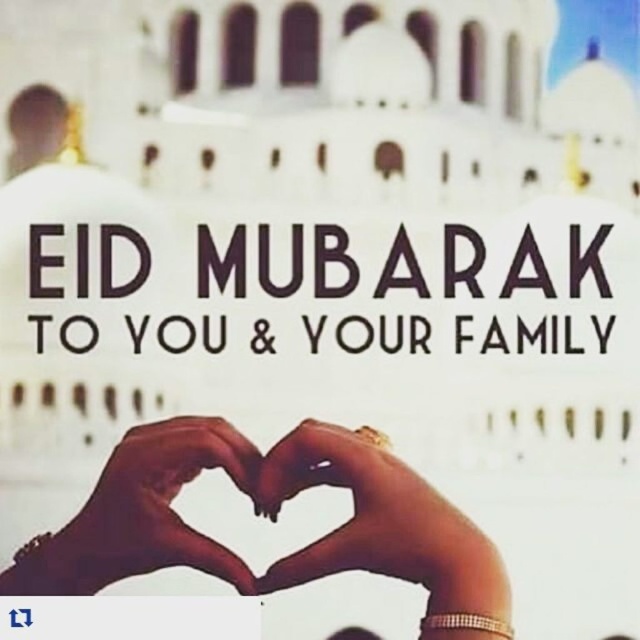
Question: Is the position of gold metallic ring at center less distant than that of brown skin tone hands at center?

Choices:
 (A) no
 (B) yes

Answer: (B)

Question: Is gold metallic ring at center wider than brown skin tone hands at center?

Choices:
 (A) yes
 (B) no

Answer: (B)

Question: Which object appears closest to the camera in this image?

Choices:
 (A) brown skin tone hands at center
 (B) gold metallic ring at center

Answer: (B)

Question: Can you confirm if gold metallic ring at center is positioned below brown skin tone hands at center?

Choices:
 (A) yes
 (B) no

Answer: (A)